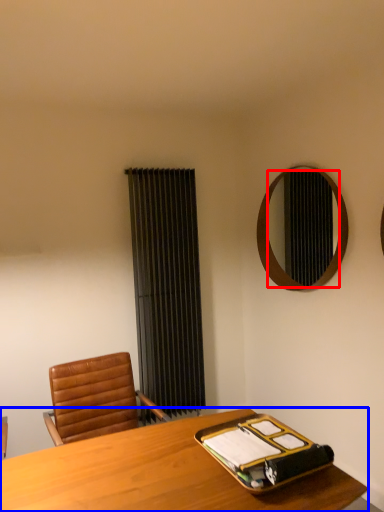
Question: Among these objects, which one is farthest to the camera, mirror (highlighted by a red box) or desk (highlighted by a blue box)?

Choices:
 (A) mirror
 (B) desk

Answer: (A)